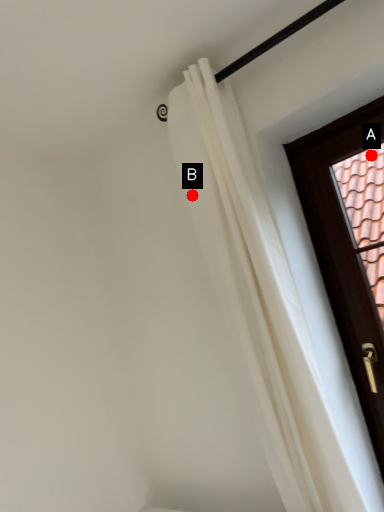
Question: Two points are circled on the image, labeled by A and B beside each circle. Among these points, which one is nearest to the camera?

Choices:
 (A) A is closer
 (B) B is closer

Answer: (B)